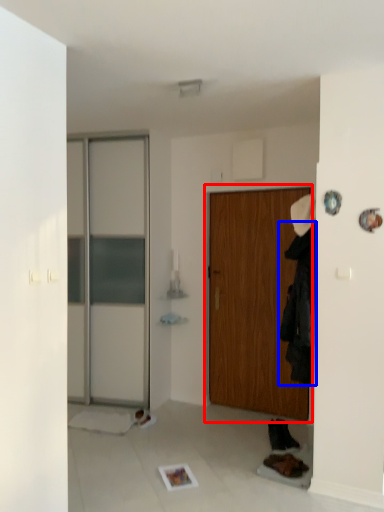
Question: Which of the following is the closest to the observer, door (highlighted by a red box) or clothing (highlighted by a blue box)?

Choices:
 (A) door
 (B) clothing

Answer: (B)